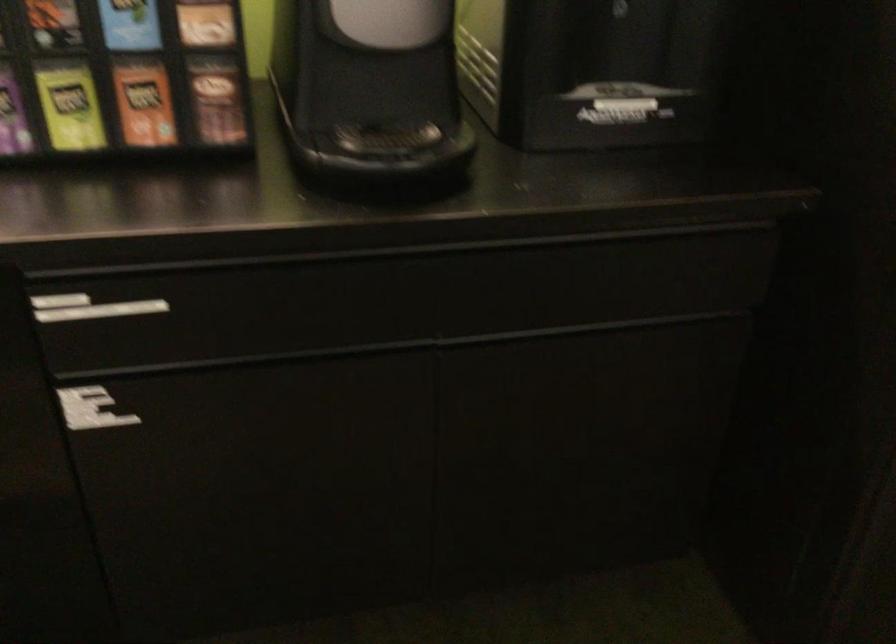
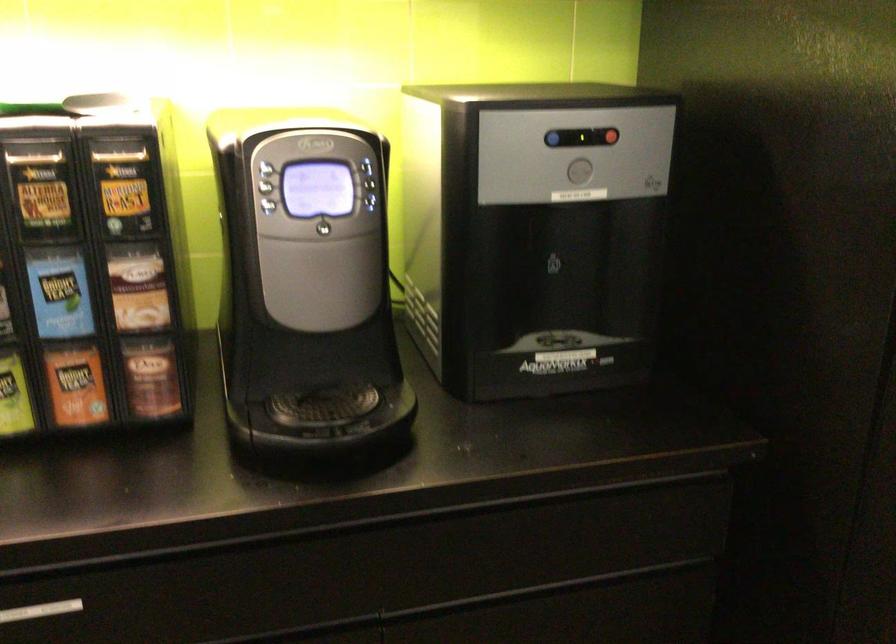
Find the pixel in the second image that matches (126,310) in the first image.

(40, 611)